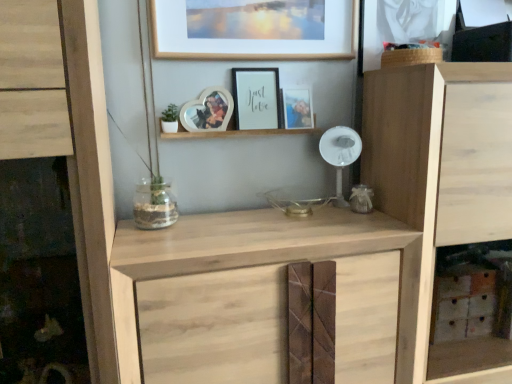
Question: Is natural wood cabinet at center in contact with white plastic fan at center?

Choices:
 (A) no
 (B) yes

Answer: (A)

Question: From the image's perspective, is natural wood cabinet at center above white plastic fan at center?

Choices:
 (A) no
 (B) yes

Answer: (A)

Question: Considering the relative sizes of natural wood cabinet at center and white plastic fan at center in the image provided, is natural wood cabinet at center shorter than white plastic fan at center?

Choices:
 (A) no
 (B) yes

Answer: (A)

Question: Is white plastic fan at center completely or partially inside natural wood cabinet at center?

Choices:
 (A) no
 (B) yes

Answer: (A)

Question: Is natural wood cabinet at center looking in the opposite direction of white plastic fan at center?

Choices:
 (A) yes
 (B) no

Answer: (B)

Question: Considering the relative positions of natural wood cabinet at center and white plastic fan at center in the image provided, is natural wood cabinet at center to the left of white plastic fan at center from the viewer's perspective?

Choices:
 (A) yes
 (B) no

Answer: (A)

Question: Is white plastic fan at center smaller than wooden picture frame at upper center, which is the 3th picture frame in left-to-right order?

Choices:
 (A) no
 (B) yes

Answer: (B)

Question: From a real-world perspective, is white plastic fan at center on wooden picture frame at upper center, the second picture frame in the right-to-left sequence?

Choices:
 (A) no
 (B) yes

Answer: (A)

Question: From a real-world perspective, is white plastic fan at center physically below wooden picture frame at upper center, which is the 3th picture frame in left-to-right order?

Choices:
 (A) no
 (B) yes

Answer: (B)

Question: Does white plastic fan at center come behind wooden picture frame at upper center, the second picture frame in the right-to-left sequence?

Choices:
 (A) yes
 (B) no

Answer: (A)

Question: Can you confirm if white plastic fan at center is thinner than wooden picture frame at upper center, which is the 3th picture frame in left-to-right order?

Choices:
 (A) no
 (B) yes

Answer: (A)

Question: Is white plastic fan at center touching wooden picture frame at upper center, the second picture frame in the right-to-left sequence?

Choices:
 (A) no
 (B) yes

Answer: (A)

Question: From the image's perspective, does natural wood cupboard at right, the first cupboard viewed from the right, appear lower than clear glass jar at center?

Choices:
 (A) no
 (B) yes

Answer: (B)